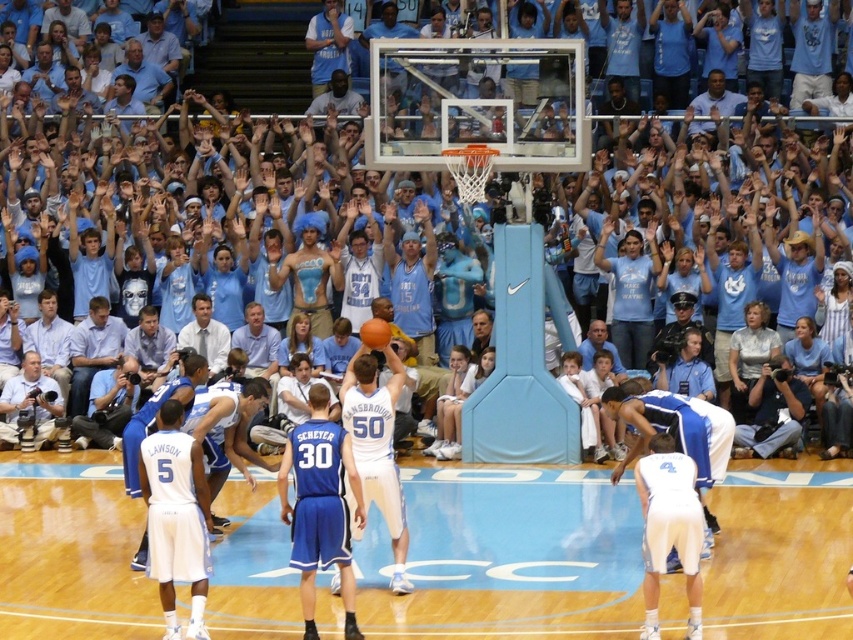
In the scene shown: You are a photographer standing at the edge of the court. You want to capture a photo of the blue fabric jacket at lower left without the wooden floor at center appearing in the background. Is this possible given their positions?

The wooden floor at center is positioned under the blue fabric jacket at lower left, so if you position yourself to focus on the jacket, the floor will still be visible beneath it. Adjust your angle to frame the jacket without the floor if possible.

You are a referee in this basketball game and need to determine if the white matte basketball player at lower right is closer to the basket than the light blue shirt at center. Based on their positions, can you confirm this?

The white matte basketball player at lower right is in front of the light blue shirt at center, which means the white matte basketball player at lower right is closer to the basket than the light blue shirt at center.

Based on the scene description, where is the white matte basketball player at lower right located in the image?

The white matte basketball player at lower right is located at the 2D coordinates point (675,432).